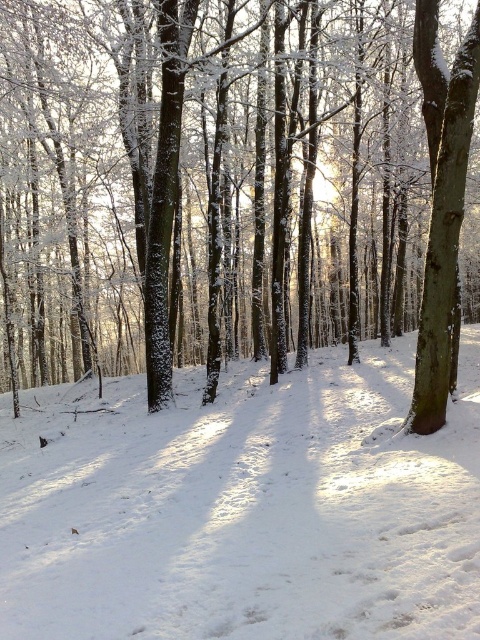
Is snow-covered tree at center wider than white powdery snow at center?

Indeed, snow-covered tree at center has a greater width compared to white powdery snow at center.

Does snow-covered tree at center appear on the left side of white powdery snow at center?

Yes, snow-covered tree at center is to the left of white powdery snow at center.

Is point (228, 330) farther from viewer compared to point (32, 609)?

That is True.

At what (x,y) coordinates should I click in order to perform the action: click on snow-covered tree at center. Please return your answer as a coordinate pair (x, y). Looking at the image, I should click on (233, 186).

Who is more forward, (256, 65) or (448, 252)?

Positioned in front is point (448, 252).

Which is in front, point (211, 232) or point (434, 316)?

Point (434, 316)

Locate an element on the screen. snow-covered tree at center is located at coordinates (233, 186).

Looking at this image, does white powdery snow at center appear over smooth bark tree at right?

No.

Does point (352, 438) come closer to viewer compared to point (439, 173)?

That is False.

What do you see at coordinates (243, 506) in the screenshot?
I see `white powdery snow at center` at bounding box center [243, 506].

At what (x,y) coordinates should I click in order to perform the action: click on white powdery snow at center. Please return your answer as a coordinate pair (x, y). Image resolution: width=480 pixels, height=640 pixels. Looking at the image, I should click on (243, 506).